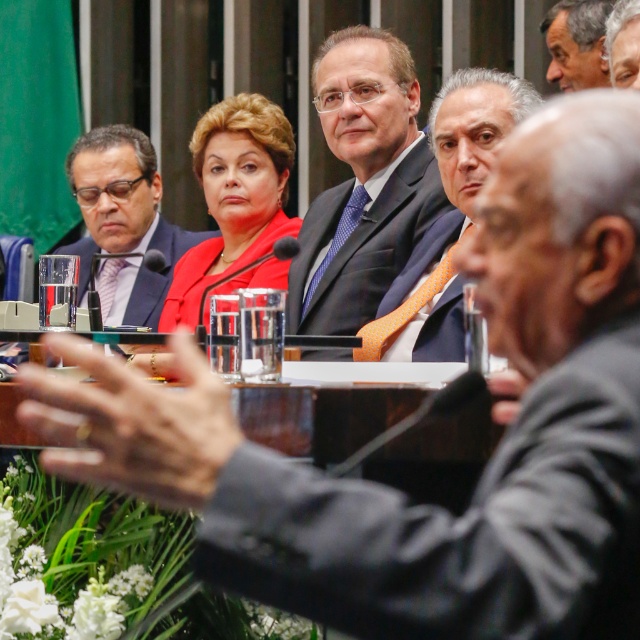
Is point (147, 300) positioned before point (605, 29)?

No, (147, 300) is behind (605, 29).

Between point (145, 301) and point (628, 83), which one is positioned behind?

The point (145, 301) is behind.

This screenshot has height=640, width=640. In order to click on matte black suit at upper center in this screenshot , I will do `click(124, 220)`.

From the picture: Between matte black suit at center and matte black suit at upper center, which one appears on the right side from the viewer's perspective?

matte black suit at center is more to the right.

Is matte black suit at center positioned before matte black suit at upper center?

Yes, matte black suit at center is closer to the viewer.

This screenshot has height=640, width=640. I want to click on matte black suit at center, so click(362, 182).

Can you confirm if orange silk tie at center is positioned to the right of gray hair at upper right?

No, orange silk tie at center is not to the right of gray hair at upper right.

Does point (536, 100) come behind point (624, 81)?

No, it is in front of (624, 81).

Between point (456, 204) and point (618, 44), which one is positioned in front?

Point (618, 44)

Image resolution: width=640 pixels, height=640 pixels. I want to click on orange silk tie at center, so click(x=449, y=196).